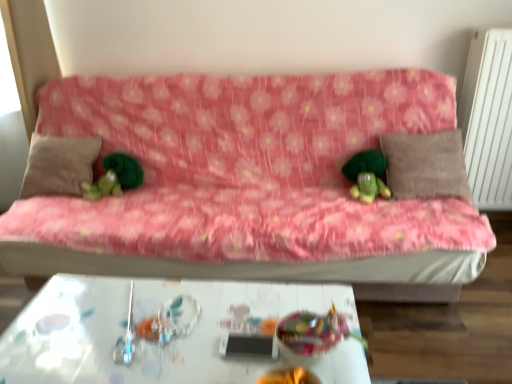
This screenshot has width=512, height=384. What are the coordinates of `free space above white glossy table at center (from a real-world perspective)` in the screenshot? It's located at (x=170, y=324).